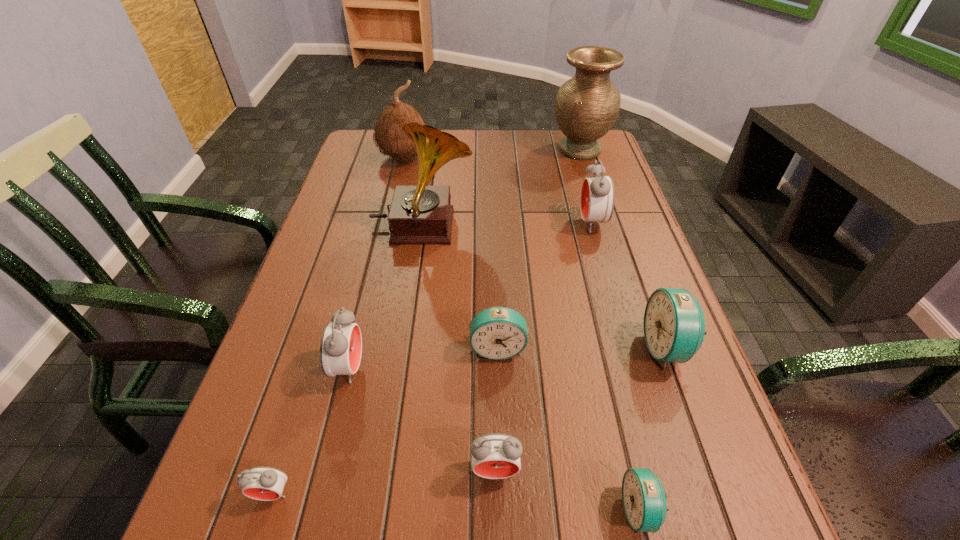
Image resolution: width=960 pixels, height=540 pixels. What are the coordinates of `vacant space located on the front-facing side of the rightmost blue alarm clock` in the screenshot? It's located at (554, 348).

The height and width of the screenshot is (540, 960). I want to click on vacant space located 0.390m on the front-facing side of the rightmost blue alarm clock, so click(x=448, y=348).

The image size is (960, 540). Find the location of `vacant space located on the front-facing side of the rightmost blue alarm clock`. vacant space located on the front-facing side of the rightmost blue alarm clock is located at coordinates (479, 348).

The width and height of the screenshot is (960, 540). In order to click on vacant space located on the front-facing side of the leftmost blue alarm clock in this screenshot , I will do `click(499, 395)`.

At what (x,y) coordinates should I click in order to perform the action: click on vase that is at the far edge. Please return your answer as a coordinate pair (x, y). The height and width of the screenshot is (540, 960). Looking at the image, I should click on (586, 107).

This screenshot has height=540, width=960. I want to click on coconut at the far edge, so click(x=389, y=136).

In order to click on phonograph record that is at the left edge in this screenshot , I will do 421,214.

Locate an element on the screen. This screenshot has width=960, height=540. coconut at the left edge is located at coordinates (389, 136).

At what (x,y) coordinates should I click in order to perform the action: click on vase situated at the right edge. Please return your answer as a coordinate pair (x, y). Looking at the image, I should click on (586, 107).

The image size is (960, 540). I want to click on object at the far left corner, so click(389, 136).